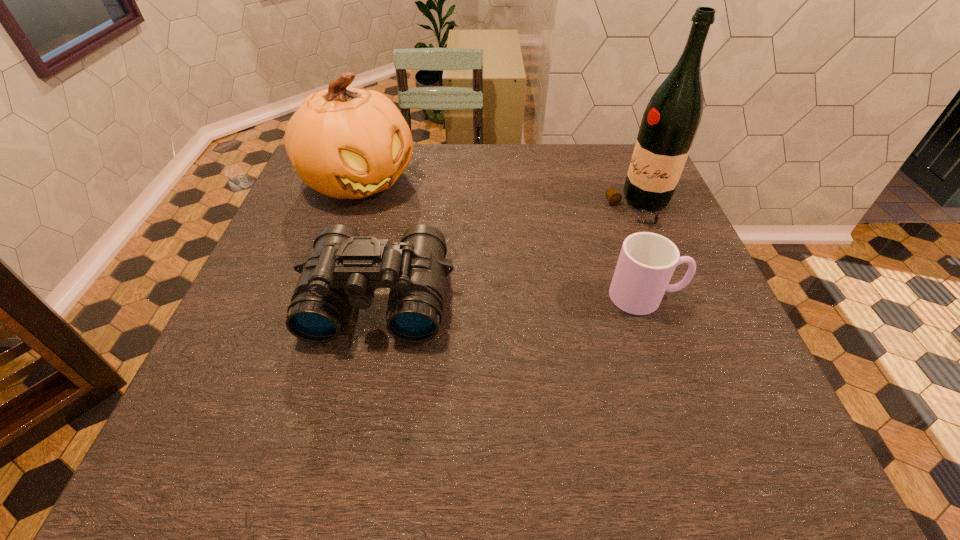
What are the coordinates of `vacant region between the cup and the third shortest object` in the screenshot? It's located at (503, 239).

The height and width of the screenshot is (540, 960). In order to click on unoccupied position between the binoculars and the cup in this screenshot , I will do pyautogui.click(x=512, y=297).

Locate an element on the screen. vacant space in between the cup and the binoculars is located at coordinates (512, 297).

Locate an element on the screen. The width and height of the screenshot is (960, 540). object that stands as the second closest to the third shortest object is located at coordinates (647, 261).

Identify the location of object that stands as the third closest to the binoculars. (670, 122).

At what (x,y) coordinates should I click in order to perform the action: click on vacant space that satisfies the following two spatial constraints: 1. on the front side of the tallest object; 2. on the right side of the pumpkin. Please return your answer as a coordinate pair (x, y). The width and height of the screenshot is (960, 540). Looking at the image, I should click on (351, 207).